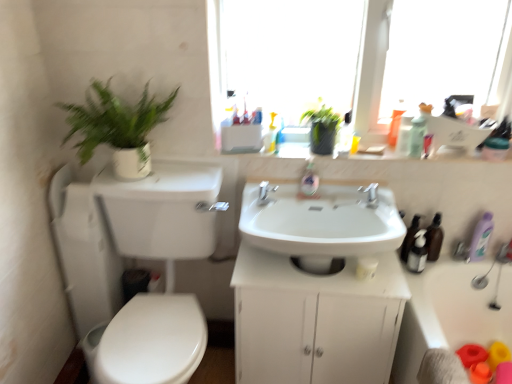
Locate an element on the screen. This screenshot has height=384, width=512. free space that is to the left of silver metallic faucet at center, the 1th tap from the right is located at coordinates (335, 197).